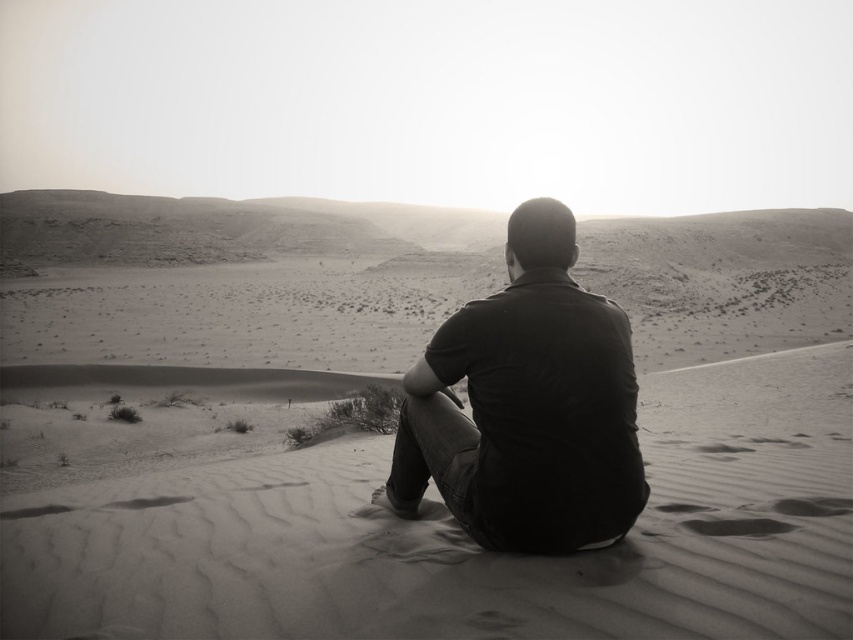
Image resolution: width=853 pixels, height=640 pixels. I want to click on smooth sand at center, so click(467, 538).

Does smooth sand at center have a greater width compared to dark cotton shirt at center?

Correct, the width of smooth sand at center exceeds that of dark cotton shirt at center.

You are a GUI agent. You are given a task and a screenshot of the screen. Output one action in this format:
    pyautogui.click(x=<x>, y=<y>)
    Task: Click on the smooth sand at center
    The height and width of the screenshot is (640, 853).
    Given the screenshot: What is the action you would take?
    pyautogui.click(x=467, y=538)

This screenshot has width=853, height=640. In order to click on smooth sand at center in this screenshot , I will do `click(467, 538)`.